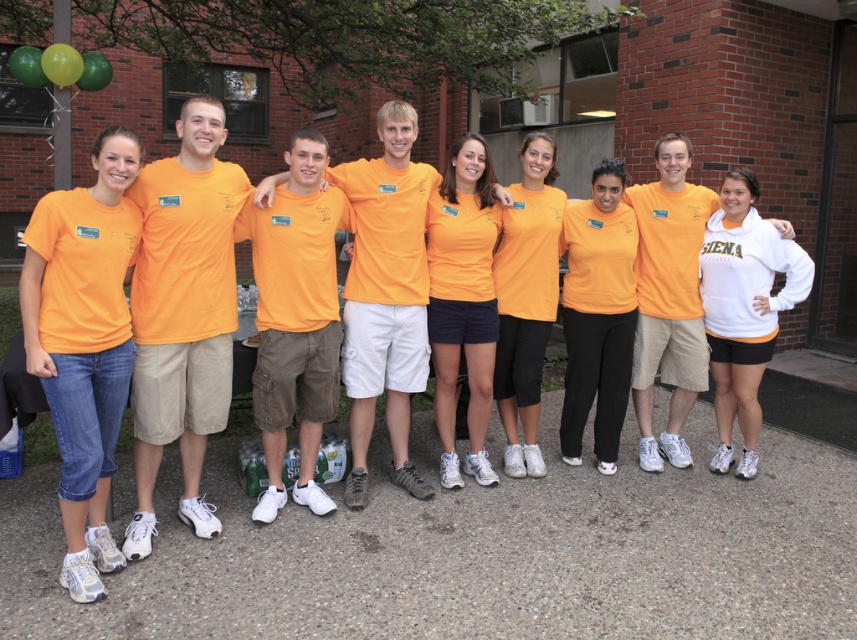
Question: Is orange matte shorts at center thinner than orange matte shirt at center?

Choices:
 (A) no
 (B) yes

Answer: (A)

Question: Which of the following is the closest to the observer?

Choices:
 (A) orange matte shirt at center
 (B) matte orange t-shirt at left
 (C) orange matte shorts at center
 (D) white fleece sweatshirt at center

Answer: (B)

Question: Estimate the real-world distances between objects in this image. Which object is closer to the white fleece sweatshirt at center?

Choices:
 (A) orange matte shorts at center
 (B) matte orange t-shirt at left
 (C) orange matte shirt at center

Answer: (C)

Question: In this image, where is matte orange t-shirt at left located relative to orange matte shirt at center?

Choices:
 (A) left
 (B) right

Answer: (A)

Question: Does orange matte shorts at center have a greater width compared to orange matte shirt at center?

Choices:
 (A) no
 (B) yes

Answer: (B)

Question: Which is nearer to the matte orange t-shirt at left?

Choices:
 (A) white fleece sweatshirt at center
 (B) orange matte shirt at center

Answer: (B)